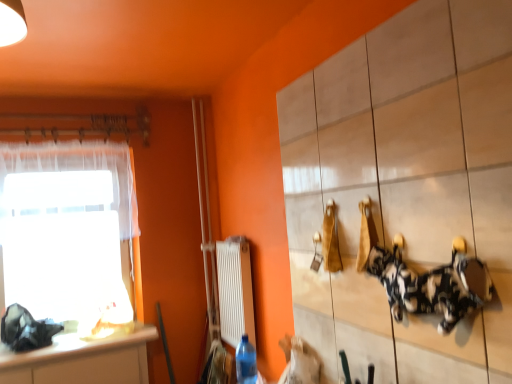
This screenshot has width=512, height=384. What do you see at coordinates (405, 186) in the screenshot?
I see `white tile cabinet at upper right` at bounding box center [405, 186].

Where is `blue plastic bottle at lower center`? blue plastic bottle at lower center is located at coordinates (246, 362).

Describe the element at coordinates (246, 362) in the screenshot. I see `blue plastic bottle at lower center` at that location.

Locate an element on the screen. Image resolution: width=512 pixels, height=384 pixels. white sheer curtain at left is located at coordinates (78, 170).

What do you see at coordinates (68, 230) in the screenshot? I see `transparent fabric at left` at bounding box center [68, 230].

This screenshot has height=384, width=512. What are the coordinates of `white tile cabinet at upper right` in the screenshot? It's located at [405, 186].

I want to click on radiator located underneath the white sheer curtain at left (from a real-world perspective), so click(234, 290).

Consider the image. Is white plastic radiator at center taller or shorter than white sheer curtain at left?

Clearly, white plastic radiator at center is shorter compared to white sheer curtain at left.

Which is behind, point (224, 326) or point (78, 145)?

The point (78, 145) is farther.

Based on the photo, from the image's perspective, is transparent fabric at left over white plastic radiator at center?

Yes.

Considering the relative sizes of transparent fabric at left and white plastic radiator at center in the image provided, is transparent fabric at left thinner than white plastic radiator at center?

Yes.

Which object is further away from the camera taking this photo, transparent fabric at left or white plastic radiator at center?

transparent fabric at left is further from the camera.

Is transparent fabric at left aimed at white plastic radiator at center?

No, transparent fabric at left is not turned towards white plastic radiator at center.

Between point (219, 305) and point (4, 369), which one is positioned behind?

Positioned behind is point (219, 305).

How distant is white plastic radiator at center from white glossy countertop at lower left?

white plastic radiator at center is 28.93 inches from white glossy countertop at lower left.

Who is smaller, white plastic radiator at center or white glossy countertop at lower left?

white glossy countertop at lower left.

Between white tile cabinet at upper right and blue plastic bottle at lower center, which one has less height?

Standing shorter between the two is blue plastic bottle at lower center.

Can blue plastic bottle at lower center be found inside white tile cabinet at upper right?

Actually, blue plastic bottle at lower center is outside white tile cabinet at upper right.

Is white tile cabinet at upper right turned away from blue plastic bottle at lower center?

That's not correct — white tile cabinet at upper right is not looking away from blue plastic bottle at lower center.

Considering the sizes of white tile cabinet at upper right and blue plastic bottle at lower center in the image, is white tile cabinet at upper right wider or thinner than blue plastic bottle at lower center?

Considering their sizes, white tile cabinet at upper right looks slimmer than blue plastic bottle at lower center.

Locate an element on the screen. The height and width of the screenshot is (384, 512). countertop below the transparent fabric at left (from a real-world perspective) is located at coordinates (82, 360).

Is white glossy countertop at lower left facing towards transparent fabric at left?

No, white glossy countertop at lower left is not turned towards transparent fabric at left.

Is white glossy countertop at lower left wider or thinner than transparent fabric at left?

Considering their sizes, white glossy countertop at lower left looks broader than transparent fabric at left.

From the image's perspective, is white glossy countertop at lower left above or below transparent fabric at left?

From the image's perspective, white glossy countertop at lower left appears below transparent fabric at left.

Find the location of a particular element. Image resolution: width=512 pixels, height=384 pixels. countertop on the left of blue plastic bottle at lower center is located at coordinates (82, 360).

Is white glossy countertop at lower left aimed at blue plastic bottle at lower center?

Yes, white glossy countertop at lower left is turned towards blue plastic bottle at lower center.

Is white glossy countertop at lower left in contact with blue plastic bottle at lower center?

They are not placed beside each other.

Is white glossy countertop at lower left at the back of blue plastic bottle at lower center?

That's not correct — blue plastic bottle at lower center is not looking away from white glossy countertop at lower left.

Which point is more distant from viewer, (244,362) or (131,363)?

Positioned behind is point (131,363).

Does blue plastic bottle at lower center have a lesser height compared to white glossy countertop at lower left?

No, blue plastic bottle at lower center is not shorter than white glossy countertop at lower left.

The width and height of the screenshot is (512, 384). Find the location of `curtain behind the white plastic radiator at center`. curtain behind the white plastic radiator at center is located at coordinates (78, 170).

Identify the location of radiator in front of the transparent fabric at left. (234, 290).

From the image, which object appears to be farther from transparent fabric at left, white glossy countertop at lower left or blue plastic bottle at lower center?

Based on the image, blue plastic bottle at lower center appears to be further to transparent fabric at left.

Considering their positions, is blue plastic bottle at lower center positioned closer to transparent fabric at left than white tile cabinet at upper right?

blue plastic bottle at lower center.

From the image, which object appears to be nearer to white glossy countertop at lower left, transparent fabric at left or blue plastic bottle at lower center?

transparent fabric at left is positioned closer to the anchor white glossy countertop at lower left.

Considering their positions, is white sheer curtain at left positioned further to blue plastic bottle at lower center than white plastic radiator at center?

white sheer curtain at left is positioned further to the anchor blue plastic bottle at lower center.

Looking at the image, which one is located further to white glossy countertop at lower left, transparent fabric at left or white plastic radiator at center?

Among the two, white plastic radiator at center is located further to white glossy countertop at lower left.

Considering their positions, is white glossy countertop at lower left positioned closer to transparent fabric at left than white tile cabinet at upper right?

white glossy countertop at lower left lies closer to transparent fabric at left than the other object.

When comparing their distances from white tile cabinet at upper right, does white plastic radiator at center or white glossy countertop at lower left seem closer?

white plastic radiator at center.

Estimate the real-world distances between objects in this image. Which object is further from white sheer curtain at left, transparent fabric at left or white glossy countertop at lower left?

white glossy countertop at lower left is further to white sheer curtain at left.

The width and height of the screenshot is (512, 384). Find the location of `bottle between transparent fabric at left and white tile cabinet at upper right in the horizontal direction`. bottle between transparent fabric at left and white tile cabinet at upper right in the horizontal direction is located at coordinates (246, 362).

The height and width of the screenshot is (384, 512). What are the coordinates of `countertop situated between white sheer curtain at left and blue plastic bottle at lower center from left to right` in the screenshot? It's located at (82, 360).

Find the location of a particular element. Image resolution: width=512 pixels, height=384 pixels. curtain between transparent fabric at left and white plastic radiator at center from left to right is located at coordinates (78, 170).

At what (x,y) coordinates should I click in order to perform the action: click on countertop between transparent fabric at left and white plastic radiator at center. Please return your answer as a coordinate pair (x, y). Looking at the image, I should click on (82, 360).